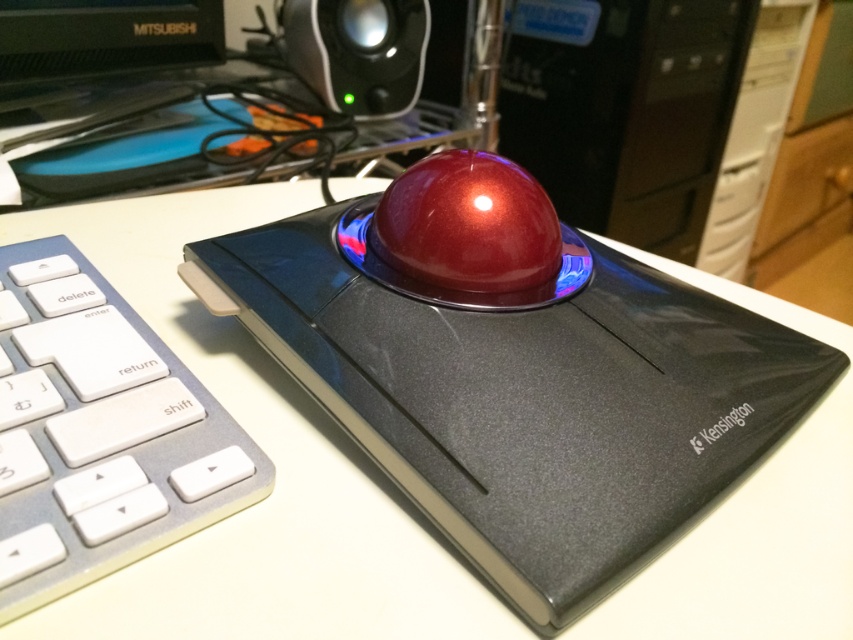
You are a photographer trying to capture a detailed shot of the trackball mouse. You notice two points marked in the scene. Which point, point (741, 339) or point (351, 83), is closer to your camera lens?

Point (741, 339) is closer to the camera lens than point (351, 83).

You are setting up a computer desk and want to place a Kensington trackball mouse on the desk. However, there is already a white plastic keyboard at lower left. Based on their positions, can you determine if there is enough space to place the trackball mouse next to the keyboard without overlapping?

The white plastic keyboard at lower left is positioned at point (99,433). Since the trackball mouse requires space next to it, but the exact dimensions of both items are not provided, it is unclear if there is sufficient space. Please provide more details about their sizes to determine overlap.